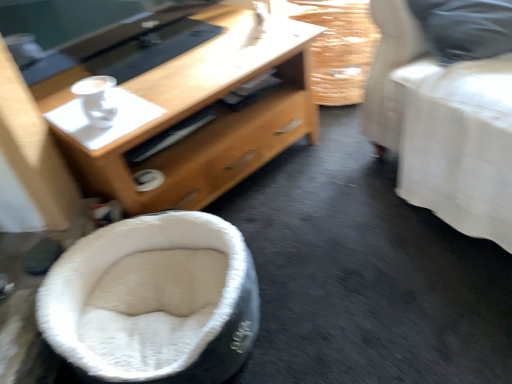
What is the approximate width of white glossy cup at upper left?

white glossy cup at upper left is 4.40 inches in width.

This screenshot has height=384, width=512. What do you see at coordinates (153, 301) in the screenshot?
I see `white fuzzy bean bag at lower left` at bounding box center [153, 301].

Find the location of a particular element. The image size is (512, 384). white fabric bed at right is located at coordinates coord(443,126).

Which is more to the left, wooden desk at center or white glossy cup at upper left?

Positioned to the left is white glossy cup at upper left.

Which is in front, wooden desk at center or white glossy cup at upper left?

wooden desk at center is more forward.

From the image's perspective, is wooden desk at center positioned above or below white glossy cup at upper left?

wooden desk at center is situated higher than white glossy cup at upper left in the image.

What's the angular difference between wooden desk at center and white glossy cup at upper left's facing directions?

The angular difference between wooden desk at center and white glossy cup at upper left is 0.941 degrees.

Does white fabric bed at right appear on the right side of white glossy cup at upper left?

Yes.

Considering the relative sizes of white fabric bed at right and white glossy cup at upper left in the image provided, is white fabric bed at right wider than white glossy cup at upper left?

Yes, white fabric bed at right is wider than white glossy cup at upper left.

Is white glossy cup at upper left surrounded by white fabric bed at right?

No, white glossy cup at upper left is located outside of white fabric bed at right.

Who is bigger, wooden desk at center or white fuzzy bean bag at lower left?

With larger size is wooden desk at center.

From a real-world perspective, between wooden desk at center and white fuzzy bean bag at lower left, who is vertically higher?

wooden desk at center is physically above.

Considering their positions, is wooden desk at center located in front of or behind white fuzzy bean bag at lower left?

Visually, wooden desk at center is located behind white fuzzy bean bag at lower left.

Is wooden desk at center beside white fuzzy bean bag at lower left?

No, wooden desk at center is not beside white fuzzy bean bag at lower left.

Which object is positioned more to the left, white fuzzy bean bag at lower left or wooden desk at center?

white fuzzy bean bag at lower left is more to the left.

Is white fuzzy bean bag at lower left taller or shorter than wooden desk at center?

In the image, white fuzzy bean bag at lower left appears to be shorter than wooden desk at center.

Is white fuzzy bean bag at lower left completely or partially outside of wooden desk at center?

Indeed, white fuzzy bean bag at lower left is completely outside wooden desk at center.

Is white fabric bed at right at the left side of wooden desk at center?

In fact, white fabric bed at right is to the right of wooden desk at center.

Can you confirm if white fabric bed at right is thinner than wooden desk at center?

Incorrect, the width of white fabric bed at right is not less than that of wooden desk at center.

From the image's perspective, is white fabric bed at right located above or below wooden desk at center?

From the image's perspective, white fabric bed at right appears above wooden desk at center.

Are burlap-like fabric basket at upper right and white glossy cup at upper left making contact?

No, burlap-like fabric basket at upper right is not beside white glossy cup at upper left.

Considering the sizes of objects burlap-like fabric basket at upper right and white glossy cup at upper left in the image provided, who is taller, burlap-like fabric basket at upper right or white glossy cup at upper left?

burlap-like fabric basket at upper right is taller.

From a real-world perspective, relative to white glossy cup at upper left, is burlap-like fabric basket at upper right vertically above or below?

burlap-like fabric basket at upper right is below white glossy cup at upper left.

Is burlap-like fabric basket at upper right located outside white glossy cup at upper left?

Yes, burlap-like fabric basket at upper right is located beyond the bounds of white glossy cup at upper left.

Is white glossy cup at upper left positioned behind white fuzzy bean bag at lower left?

Yes, the depth of white glossy cup at upper left is greater than that of white fuzzy bean bag at lower left.

In the scene shown: Which of these two, white glossy cup at upper left or white fuzzy bean bag at lower left, is thinner?

With smaller width is white glossy cup at upper left.

Is white glossy cup at upper left not inside white fuzzy bean bag at lower left?

Yes, white glossy cup at upper left is located beyond the bounds of white fuzzy bean bag at lower left.

From a real-world perspective, is white glossy cup at upper left located higher than white fuzzy bean bag at lower left?

Yes, from a real-world perspective, white glossy cup at upper left is over white fuzzy bean bag at lower left

Identify the location of desk beneath the white glossy cup at upper left (from a real-world perspective). The height and width of the screenshot is (384, 512). (185, 110).

You are a GUI agent. You are given a task and a screenshot of the screen. Output one action in this format:
    pyautogui.click(x=<x>, y=<y>)
    Task: Click on the coffee that appears on the left of white fabric bed at right
    This screenshot has width=512, height=384.
    Given the screenshot: What is the action you would take?
    pyautogui.click(x=96, y=99)

When comparing their distances from white fabric bed at right, does white glossy cup at upper left or burlap-like fabric basket at upper right seem further?

The object further to white fabric bed at right is white glossy cup at upper left.

From the image, which object appears to be farther from burlap-like fabric basket at upper right, white fabric bed at right or white fuzzy bean bag at lower left?

Among the two, white fuzzy bean bag at lower left is located further to burlap-like fabric basket at upper right.

Which object lies nearer to the anchor point white fuzzy bean bag at lower left, white fabric bed at right or burlap-like fabric basket at upper right?

The object closer to white fuzzy bean bag at lower left is white fabric bed at right.

When comparing their distances from white glossy cup at upper left, does white fuzzy bean bag at lower left or white fabric bed at right seem further?

Based on the image, white fabric bed at right appears to be further to white glossy cup at upper left.

From the image, which object appears to be nearer to wooden desk at center, white glossy cup at upper left or white fabric bed at right?

Based on the image, white glossy cup at upper left appears to be nearer to wooden desk at center.

Looking at the image, which one is located closer to white glossy cup at upper left, white fabric bed at right or white fuzzy bean bag at lower left?

Among the two, white fuzzy bean bag at lower left is located nearer to white glossy cup at upper left.

Considering their positions, is wooden desk at center positioned closer to white glossy cup at upper left than white fuzzy bean bag at lower left?

The object closer to white glossy cup at upper left is wooden desk at center.

From the image, which object appears to be farther from white glossy cup at upper left, white fabric bed at right or wooden desk at center?

Based on the image, white fabric bed at right appears to be further to white glossy cup at upper left.

You are a GUI agent. You are given a task and a screenshot of the screen. Output one action in this format:
    pyautogui.click(x=<x>, y=<y>)
    Task: Click on the desk between white glossy cup at upper left and white fabric bed at right in the horizontal direction
    
    Given the screenshot: What is the action you would take?
    pyautogui.click(x=185, y=110)

The width and height of the screenshot is (512, 384). Find the location of `desk that lies between burlap-like fabric basket at upper right and white fuzzy bean bag at lower left from top to bottom`. desk that lies between burlap-like fabric basket at upper right and white fuzzy bean bag at lower left from top to bottom is located at coordinates (185, 110).

Locate an element on the screen. The image size is (512, 384). bean bag chair located between white glossy cup at upper left and white fabric bed at right in the left-right direction is located at coordinates (153, 301).

Where is `desk between white fuzzy bean bag at lower left and white fabric bed at right from left to right`? desk between white fuzzy bean bag at lower left and white fabric bed at right from left to right is located at coordinates (185, 110).